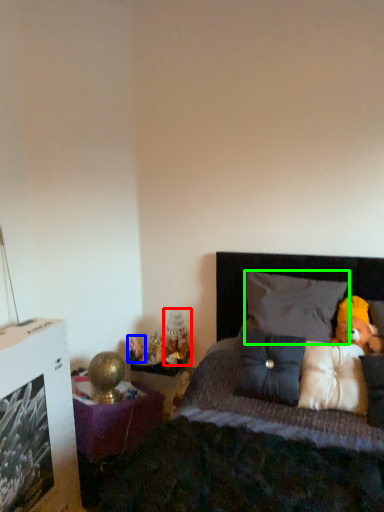
Question: Which object is the closest to the table lamp (highlighted by a red box)? Choose among these: toy (highlighted by a blue box) or pillow (highlighted by a green box).

Choices:
 (A) toy
 (B) pillow

Answer: (A)